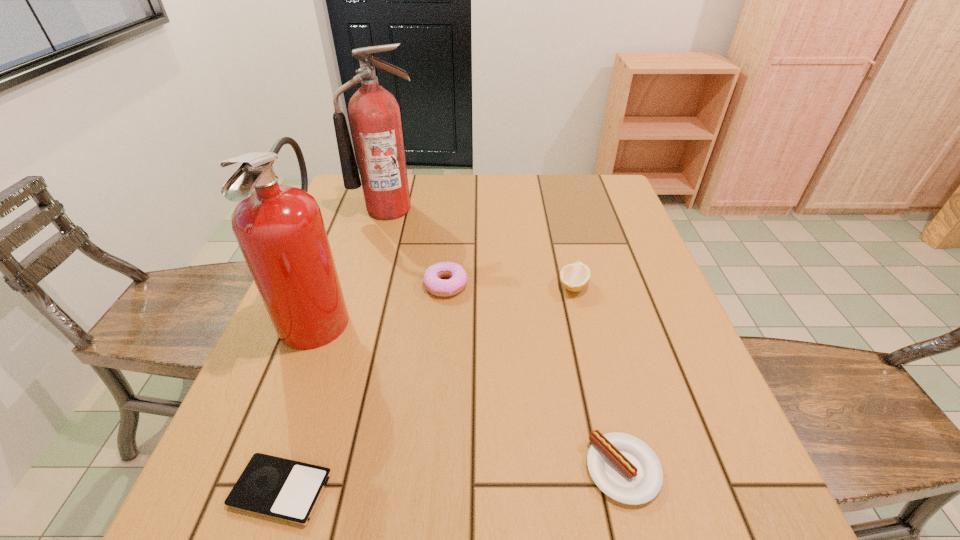
Locate an element on the screen. This screenshot has width=960, height=540. free space located 0.370m on the back of the sausage is located at coordinates (579, 293).

Identify the location of blank space located 0.160m on the right of the iPod. The height and width of the screenshot is (540, 960). (428, 490).

The width and height of the screenshot is (960, 540). Find the location of `object located at the far edge`. object located at the far edge is located at coordinates (374, 114).

In order to click on sausage that is at the near edge in this screenshot , I will do `click(626, 469)`.

This screenshot has height=540, width=960. Find the location of `iPod that is positioned at the near edge`. iPod that is positioned at the near edge is located at coordinates (287, 490).

Locate an element on the screen. Image resolution: width=960 pixels, height=540 pixels. iPod present at the left edge is located at coordinates (287, 490).

What are the coordinates of `object located at the right edge` in the screenshot? It's located at (626, 469).

The height and width of the screenshot is (540, 960). Identify the location of object situated at the far left corner. (374, 114).

Identify the location of object present at the near left corner. (287, 490).

Identify the location of object located at the near right corner. This screenshot has height=540, width=960. pos(626,469).